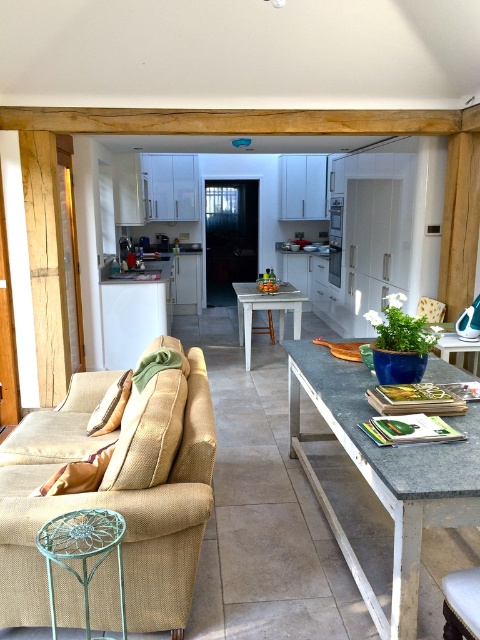
You are planning to host a dinner party and need to seat 8 guests. The white painted wood table at center and the granite table at center are both available. Which table should you choose based on their width?

The white painted wood table at center is wider than the granite table at center, so it can accommodate more guests comfortably.

You are planning to place a large centerpiece on the table in the center of the living space. Which table should you place it on, the white painted wood table at center or the granite table at center, and why?

You should place the centerpiece on the white painted wood table at center because it is positioned over the granite table at center, making it the upper table where the centerpiece would be visible.

You are planning to place a tall vase on the table. Which table, the white painted wood table at center or the granite table at center, is more suitable for the vase to ensure it doesn

The white painted wood table at center is more suitable because it has a greater height compared to the granite table at center, allowing the tall vase to be placed stably without overhanging.